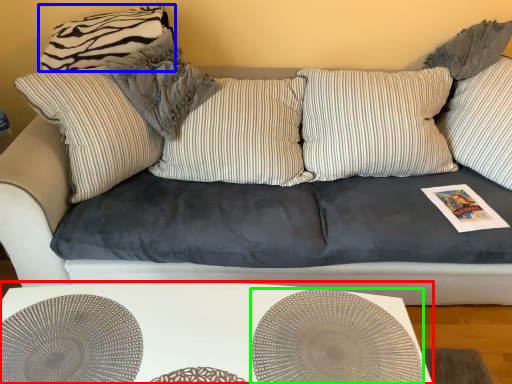
Question: Which is nearer to the table (highlighted by a red box)? pillow (highlighted by a blue box) or circle (highlighted by a green box).

Choices:
 (A) pillow
 (B) circle

Answer: (B)